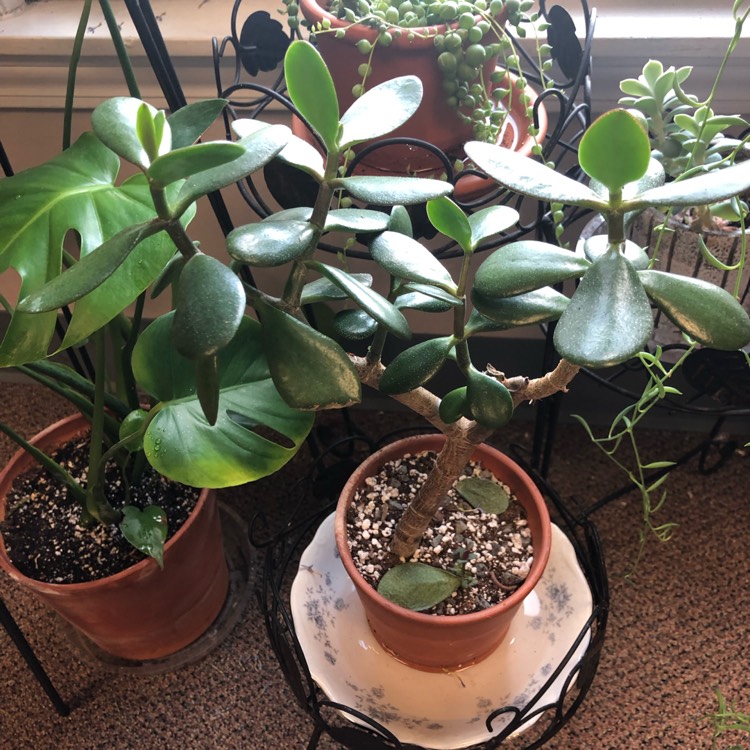
Where is `red plant pot`? red plant pot is located at coordinates (392, 634), (178, 602).